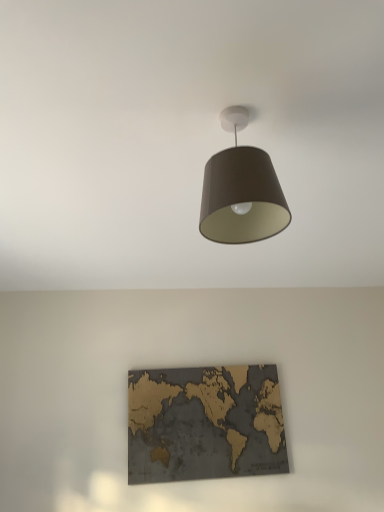
Question: Considering the positions of gold textured map at center and matte brown lampshade at upper center in the image, is gold textured map at center taller or shorter than matte brown lampshade at upper center?

Choices:
 (A) short
 (B) tall

Answer: (B)

Question: Considering the positions of point (235, 387) and point (253, 186), is point (235, 387) closer or farther from the camera than point (253, 186)?

Choices:
 (A) closer
 (B) farther

Answer: (B)

Question: Is gold textured map at center spatially inside matte brown lampshade at upper center, or outside of it?

Choices:
 (A) outside
 (B) inside

Answer: (A)

Question: Based on their sizes in the image, would you say matte brown lampshade at upper center is bigger or smaller than gold textured map at center?

Choices:
 (A) big
 (B) small

Answer: (A)

Question: Considering their positions, is matte brown lampshade at upper center located in front of or behind gold textured map at center?

Choices:
 (A) behind
 (B) front

Answer: (B)

Question: Considering the positions of point (221, 174) and point (137, 460), is point (221, 174) closer or farther from the camera than point (137, 460)?

Choices:
 (A) farther
 (B) closer

Answer: (B)

Question: Considering the relative positions of matte brown lampshade at upper center and gold textured map at center in the image provided, is matte brown lampshade at upper center to the left or to the right of gold textured map at center?

Choices:
 (A) right
 (B) left

Answer: (A)